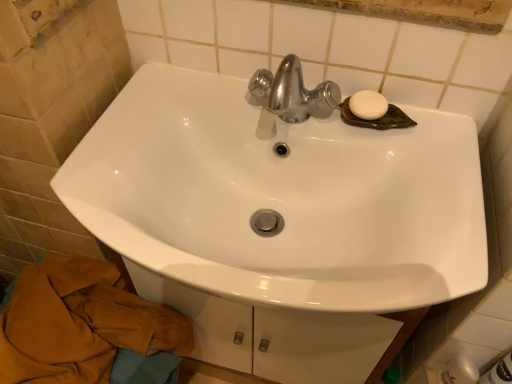
At what (x,y) coordinates should I click in order to perform the action: click on free space in front of white matte soap at upper right. Please return your answer as a coordinate pair (x, y). This screenshot has height=384, width=512. Looking at the image, I should click on [x=428, y=181].